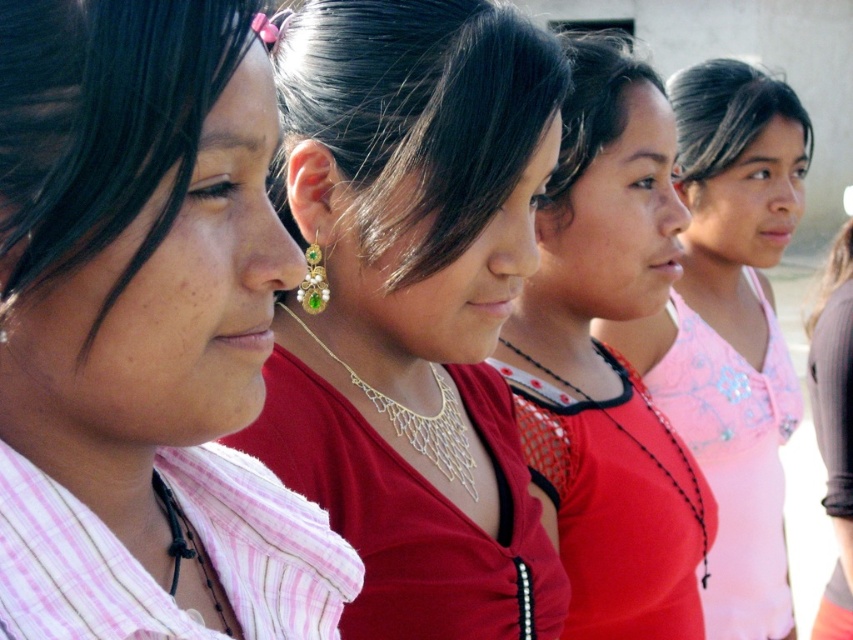
Question: Is gold mesh necklace at center above gold metallic necklace at center?

Choices:
 (A) yes
 (B) no

Answer: (B)

Question: Which of these objects is positioned farthest from the red mesh dress at center?

Choices:
 (A) gold mesh necklace at center
 (B) goldearring at center
 (C) gold metallic necklace at center
 (D) pink fabric dress at right

Answer: (D)

Question: In this image, where is pink striped shirt at left located relative to matte red blouse at center?

Choices:
 (A) right
 (B) left

Answer: (B)

Question: Which object appears closest to the camera in this image?

Choices:
 (A) goldearring at center
 (B) pink fabric top at center
 (C) pink fabric dress at right

Answer: (A)

Question: Does red mesh dress at center appear under gold metallic necklace at center?

Choices:
 (A) no
 (B) yes

Answer: (B)

Question: Which object is the closest to the matte red blouse at center?

Choices:
 (A) red mesh dress at center
 (B) gold mesh necklace at center

Answer: (A)